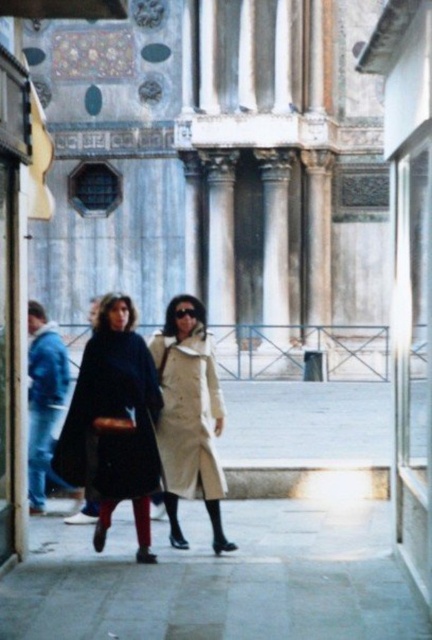
You are standing in the courtyard and want to take a photo of the light beige wool coat at center and denim jacket at lower left. Which one is closer to you?

The light beige wool coat at center is closer to you because it is in front of the denim jacket at lower left.

You are standing at the entrance of the plaza and want to approach the light beige wool coat at center and the denim jacket at lower left. Which one is closer to you?

The denim jacket at lower left is closer to you since it is only 5.79 meters away from the light beige wool coat at center, and you are at the entrance which is likely farther away.

You are standing in the courtyard and want to take a photo of the two points mentioned. Which point, point (x=98, y=384) or point (x=159, y=333), will appear larger in your photo?

Point (x=98, y=384) is closer to the camera than point (x=159, y=333), so it will appear larger in the photo.